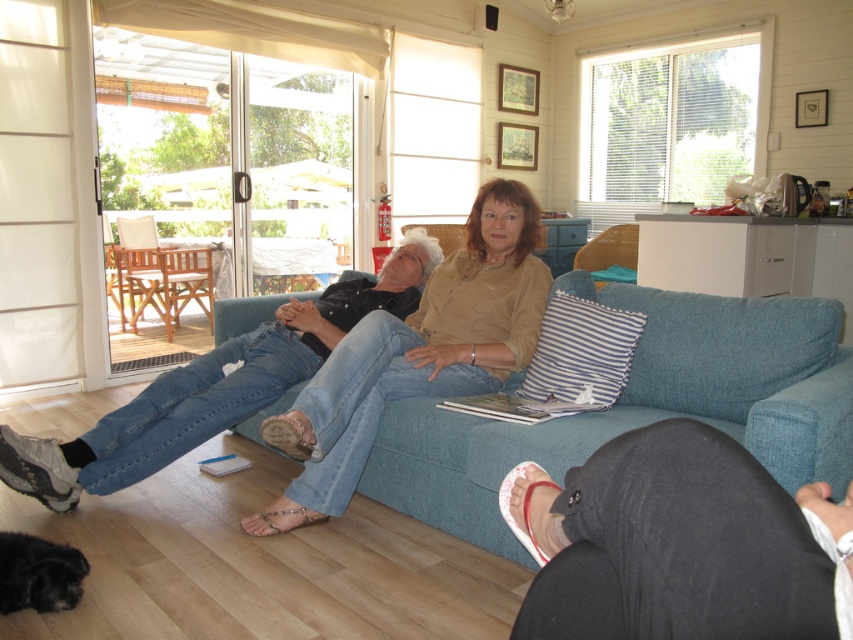
Question: Which point is closer to the camera?

Choices:
 (A) (752, 515)
 (B) (4, 540)
 (C) (538, 326)
 (D) (267, 332)

Answer: (A)

Question: Does blue fabric couch at center lie in front of denim jeans at left?

Choices:
 (A) no
 (B) yes

Answer: (B)

Question: Can you confirm if blue fabric couch at center is positioned below denim jeans at center?

Choices:
 (A) yes
 (B) no

Answer: (A)

Question: Among these objects, which one is farthest from the camera?

Choices:
 (A) denim jeans at center
 (B) blue fabric couch at center

Answer: (A)

Question: Can you confirm if blue fabric couch at center is positioned above denim jeans at left?

Choices:
 (A) yes
 (B) no

Answer: (B)

Question: Which of these objects is positioned farthest from the denim jeans at center?

Choices:
 (A) denim jeans at left
 (B) blue fabric couch at center
 (C) black fuzzy dog at lower left
 (D) black fabric pants at lower right

Answer: (D)